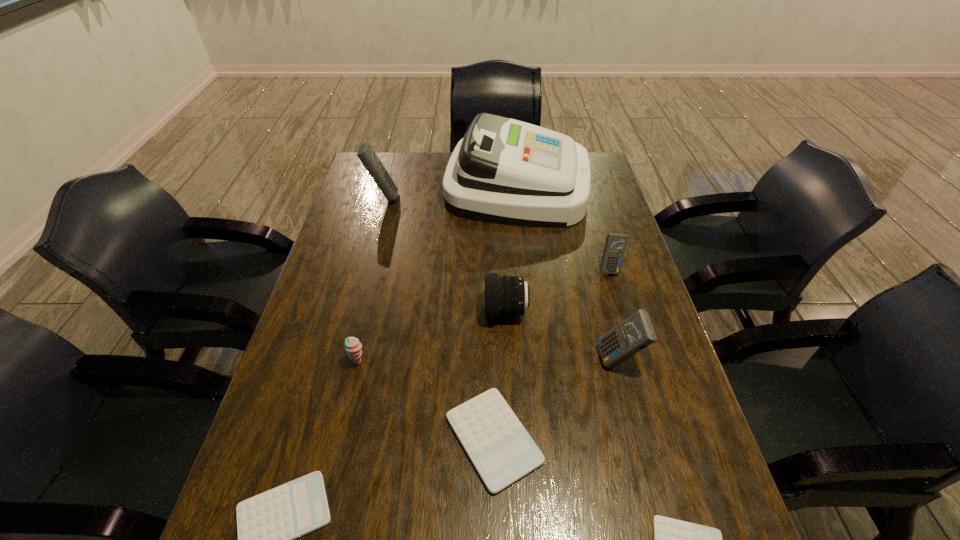
Identify which blue calculator is located as the third nearest to the fourth shortest object. Please provide its 2D coordinates. Your answer should be formatted as a tuple, i.e. [(x, y)], where the tuple contains the x and y coordinates of a point satisfying the conditions above.

[(615, 246)]

Point out which white calculator is positioned as the nearest to the tallest object. Please provide its 2D coordinates. Your answer should be formatted as a tuple, i.e. [(x, y)], where the tuple contains the x and y coordinates of a point satisfying the conditions above.

[(501, 450)]

The width and height of the screenshot is (960, 540). Identify the location of white calculator that can be found as the second closest to the black telephoto lens. (267, 524).

Identify the location of vacant space that satisfies the following two spatial constraints: 1. on the front-facing side of the seventh nearest object; 2. at the front element of the sixth nearest object. This screenshot has height=540, width=960. (622, 312).

At what (x,y) coordinates should I click in order to perform the action: click on free location that satisfies the following two spatial constraints: 1. on the front-facing side of the fifth nearest calculator; 2. on the front-facing side of the second biggest blue calculator. Please return your answer as a coordinate pair (x, y). The height and width of the screenshot is (540, 960). Looking at the image, I should click on (637, 360).

Locate an element on the screen. free point that satisfies the following two spatial constraints: 1. on the front-facing side of the fourth tallest calculator; 2. on the right side of the farthest calculator is located at coordinates (318, 438).